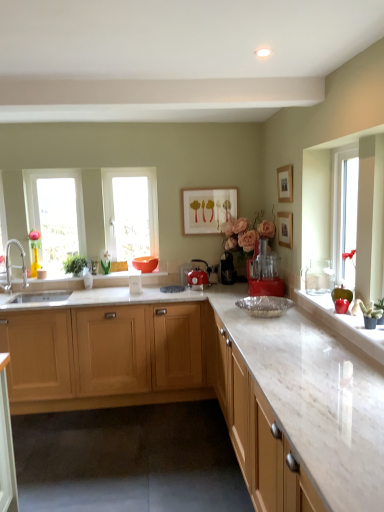
Question: From a real-world perspective, is white marble countertop at right, the first cabinetry viewed from the front, above or below matte orange bowl at center?

Choices:
 (A) above
 (B) below

Answer: (B)

Question: From the image's perspective, is white marble countertop at right, the second cabinetry from the back, located above or below matte orange bowl at center?

Choices:
 (A) above
 (B) below

Answer: (B)

Question: Based on their relative distances, which object is farther from the white marble countertop at right, the second cabinetry from the back?

Choices:
 (A) matte red kettle at center
 (B) matte orange bowl at center
 (C) green matte cactus at right, positioned as the second plant in back-to-front order
 (D) black plastic coffee machine at center, the second coffee machine viewed from the right
 (E) light wood cabinetry at center, which is the 1th cabinetry from back to front

Answer: (B)

Question: Considering the real-world distances, which object is farthest from the transparent glass window at left, positioned as the second window in right-to-left order?

Choices:
 (A) wooden picture frame at upper right, which is the 1th picture frame in right-to-left order
 (B) red plastic food processor at center, marked as the 2th coffee machine in a left-to-right arrangement
 (C) white marble countertop at right, the first cabinetry viewed from the front
 (D) matte orange bowl at center
 (E) light wood cabinetry at center, which is the second cabinetry from front to back

Answer: (A)